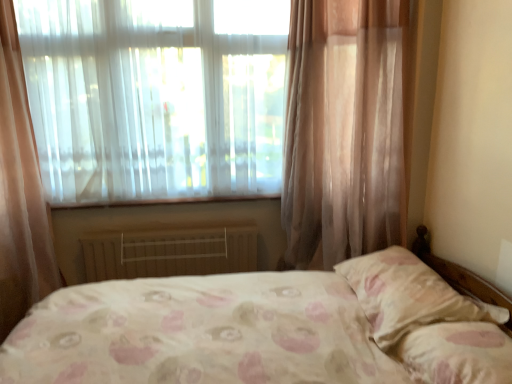
Question: From a real-world perspective, is pink floral fabric pillow at lower right, which is the second pillow in back-to-front order, over white painted metal radiator at lower center?

Choices:
 (A) yes
 (B) no

Answer: (A)

Question: Does pink floral fabric pillow at lower right, which is the second pillow in back-to-front order, have a lesser height compared to white painted metal radiator at lower center?

Choices:
 (A) yes
 (B) no

Answer: (A)

Question: Can you confirm if pink floral fabric pillow at lower right, the 1th pillow from the front, is smaller than white painted metal radiator at lower center?

Choices:
 (A) yes
 (B) no

Answer: (B)

Question: Considering the relative sizes of pink floral fabric pillow at lower right, which is the second pillow in back-to-front order, and white painted metal radiator at lower center in the image provided, is pink floral fabric pillow at lower right, which is the second pillow in back-to-front order, thinner than white painted metal radiator at lower center?

Choices:
 (A) no
 (B) yes

Answer: (A)

Question: Is pink floral fabric pillow at lower right, the 1th pillow from the front, wider than white painted metal radiator at lower center?

Choices:
 (A) yes
 (B) no

Answer: (A)

Question: Considering the relative positions of pink floral fabric pillow at right, the 2th pillow in the front-to-back sequence, and translucent fabric at upper left in the image provided, is pink floral fabric pillow at right, the 2th pillow in the front-to-back sequence, to the left or to the right of translucent fabric at upper left?

Choices:
 (A) left
 (B) right

Answer: (B)

Question: Considering the positions of pink floral fabric pillow at right, positioned as the first pillow in back-to-front order, and translucent fabric at upper left in the image, is pink floral fabric pillow at right, positioned as the first pillow in back-to-front order, taller or shorter than translucent fabric at upper left?

Choices:
 (A) tall
 (B) short

Answer: (B)

Question: Looking at their shapes, would you say pink floral fabric pillow at right, positioned as the first pillow in back-to-front order, is wider or thinner than translucent fabric at upper left?

Choices:
 (A) wide
 (B) thin

Answer: (A)

Question: From a real-world perspective, is pink floral fabric pillow at right, the 2th pillow in the front-to-back sequence, above or below translucent fabric at upper left?

Choices:
 (A) below
 (B) above

Answer: (A)

Question: From a real-world perspective, relative to translucent fabric at upper left, is white painted metal radiator at lower center vertically above or below?

Choices:
 (A) above
 (B) below

Answer: (B)

Question: In the image, is white painted metal radiator at lower center positioned in front of or behind translucent fabric at upper left?

Choices:
 (A) front
 (B) behind

Answer: (B)

Question: Looking at their shapes, would you say white painted metal radiator at lower center is wider or thinner than translucent fabric at upper left?

Choices:
 (A) thin
 (B) wide

Answer: (A)

Question: Is white painted metal radiator at lower center inside or outside of translucent fabric at upper left?

Choices:
 (A) inside
 (B) outside

Answer: (B)

Question: Considering the positions of pink floral fabric pillow at lower right, which is the second pillow in back-to-front order, and translucent fabric at upper left in the image, is pink floral fabric pillow at lower right, which is the second pillow in back-to-front order, wider or thinner than translucent fabric at upper left?

Choices:
 (A) thin
 (B) wide

Answer: (B)

Question: From a real-world perspective, relative to translucent fabric at upper left, is pink floral fabric pillow at lower right, the 1th pillow from the front, vertically above or below?

Choices:
 (A) above
 (B) below

Answer: (B)